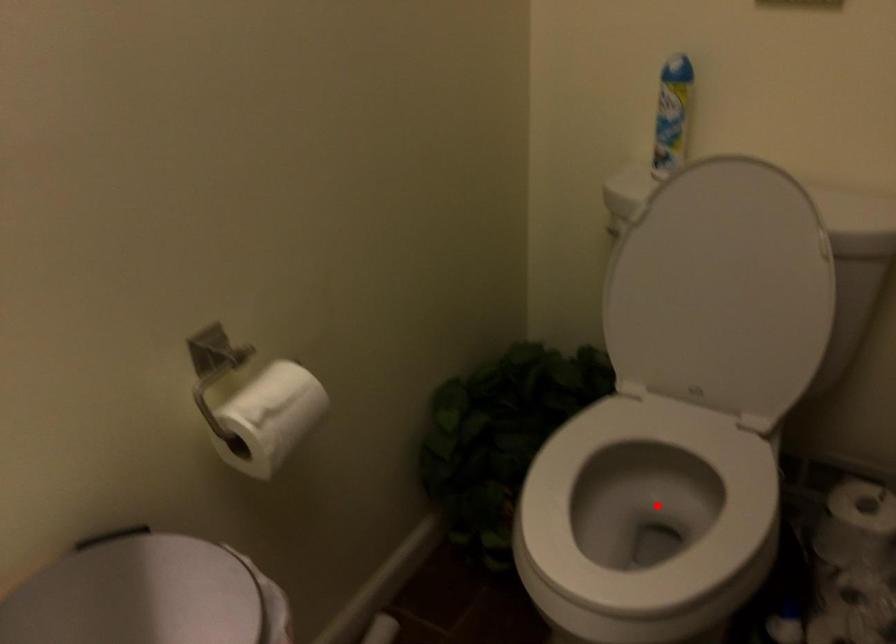
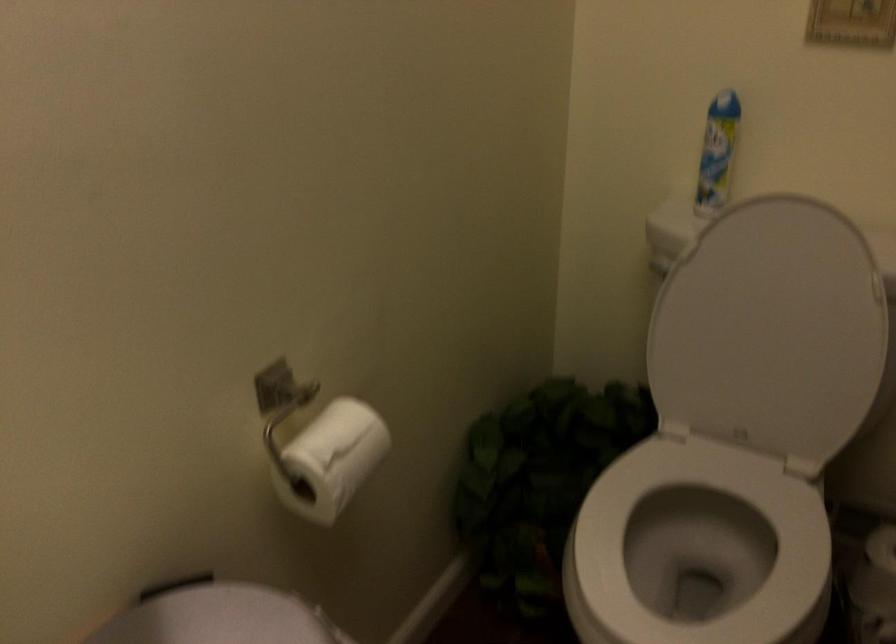
In the second image, find the point that corresponds to the highlighted location in the first image.

(698, 547)